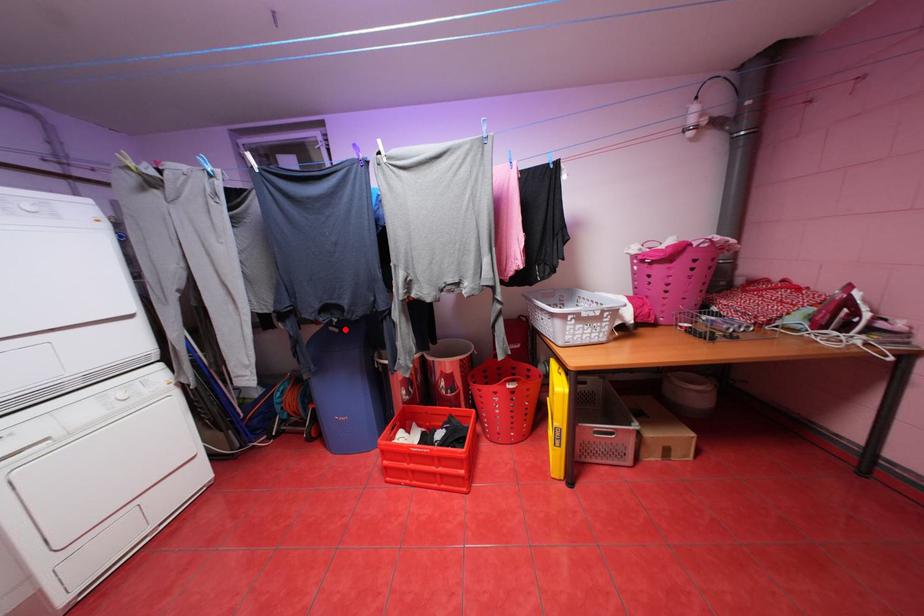
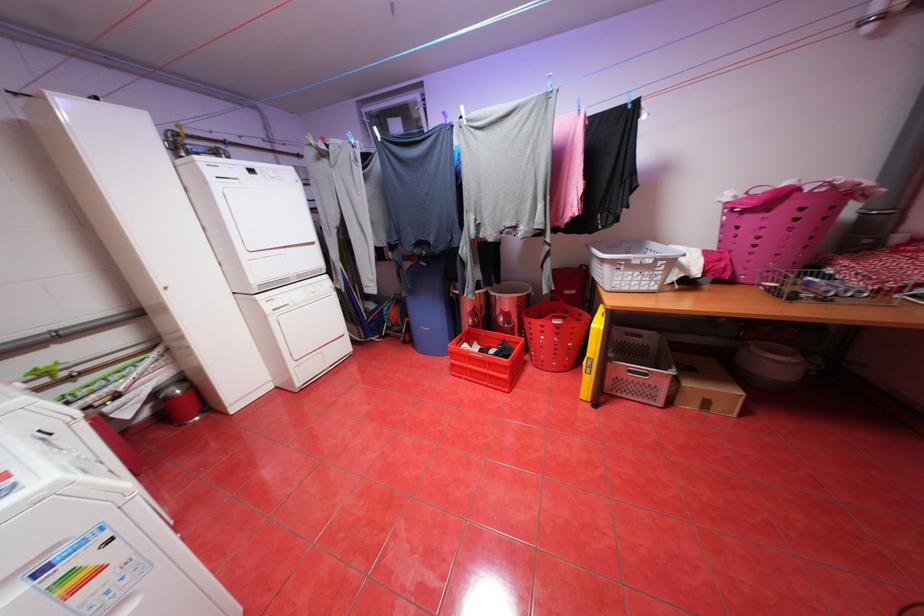
Locate, in the second image, the point that corresponds to the highlighted location in the first image.

(433, 264)